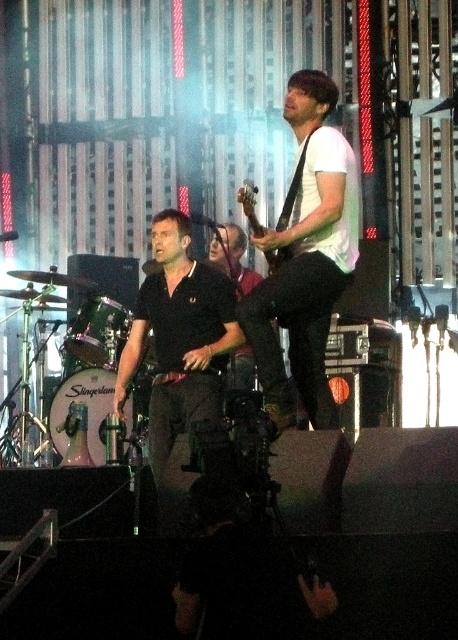
Is white matte shirt at upper center positioned before black matte shirt at center?

That is False.

Where is `white matte shirt at upper center`? white matte shirt at upper center is located at coordinates (305, 257).